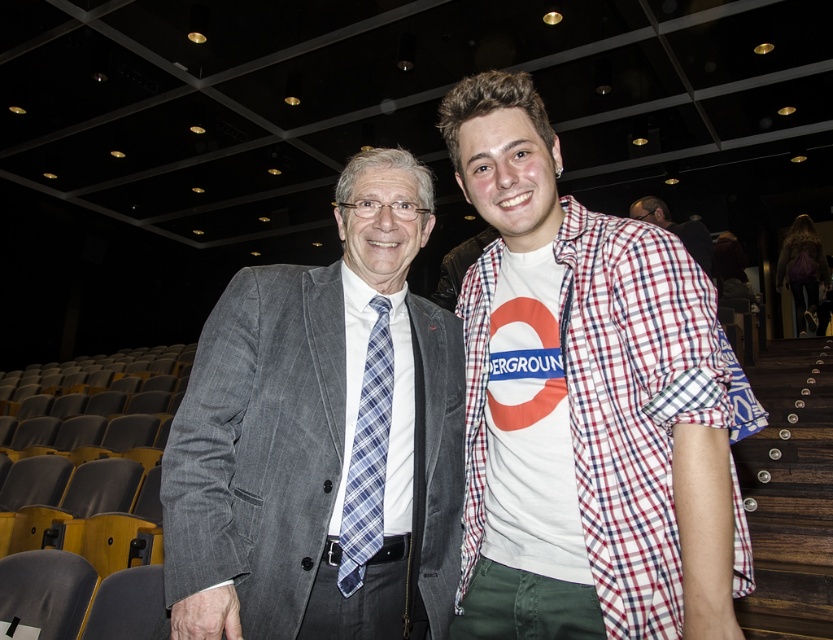
You are a photographer setting up for a group photo in an auditorium. You want to ensure that the gray wool suit at center is clearly visible in the photo. Given that your camera has a minimum focus distance of 36 inches, will you need to adjust your position to capture the suit in focus?

The gray wool suit at center is 36.53 inches away from the camera, which is slightly beyond the minimum focus distance of 36 inches. Therefore, you will need to move closer to the suit or adjust the camera settings to ensure it is in focus.